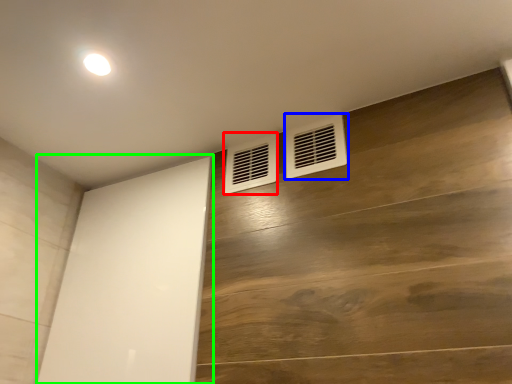
Question: Which object is positioned farthest from air conditioning (highlighted by a red box)? Select from air conditioning (highlighted by a blue box) and screen door (highlighted by a green box).

Choices:
 (A) air conditioning
 (B) screen door

Answer: (B)